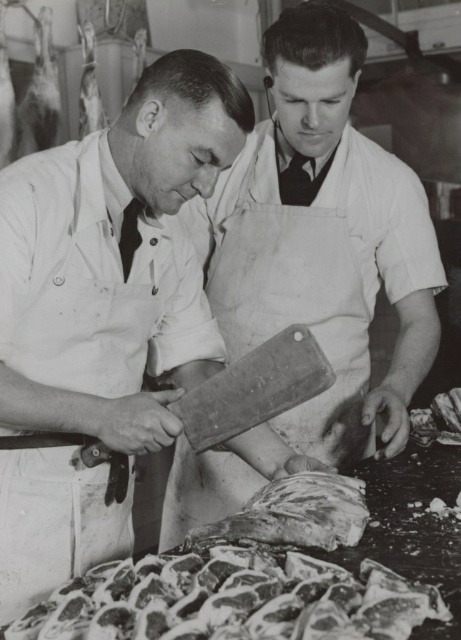
Question: Which object is the farthest from the smooth wooden cutting board at center?

Choices:
 (A) rusty metal meat at lower center
 (B) smooth white apron at center

Answer: (A)

Question: Does smooth white apron at center have a smaller size compared to rusty metal meat at lower center?

Choices:
 (A) no
 (B) yes

Answer: (A)

Question: Does smooth white apron at center lie behind rusty metal meat at lower center?

Choices:
 (A) no
 (B) yes

Answer: (B)

Question: Which point appears closest to the camera in this image?

Choices:
 (A) (133, 356)
 (B) (362, 520)
 (C) (349, 614)
 (D) (365, 428)

Answer: (C)

Question: Is the position of smooth white apron at center less distant than that of rough textured meat at center?

Choices:
 (A) yes
 (B) no

Answer: (A)

Question: Which point is farther to the camera?

Choices:
 (A) smooth wooden cutting board at center
 (B) rough textured meat at center
 (C) rusty metal meat at lower center
 (D) smooth white apron at center

Answer: (A)